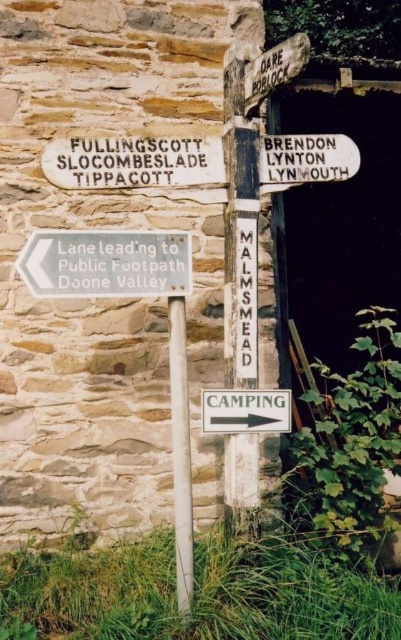
You are a hiker trying to read the signs on the wooden signpost. You notice two signs, the white wooden sign at upper right and the wooden signpost at upper center. Which one is taller?

The white wooden sign at upper right is taller than the wooden signpost at upper center.

You are a hiker trying to read two signs at a rustic wooden signpost. You notice a white plastic sign at lower left and a white wooden sign at upper right. Which sign do you have to look up to see?

You have to look up to see the white wooden sign at upper right because it is taller than the white plastic sign at lower left.